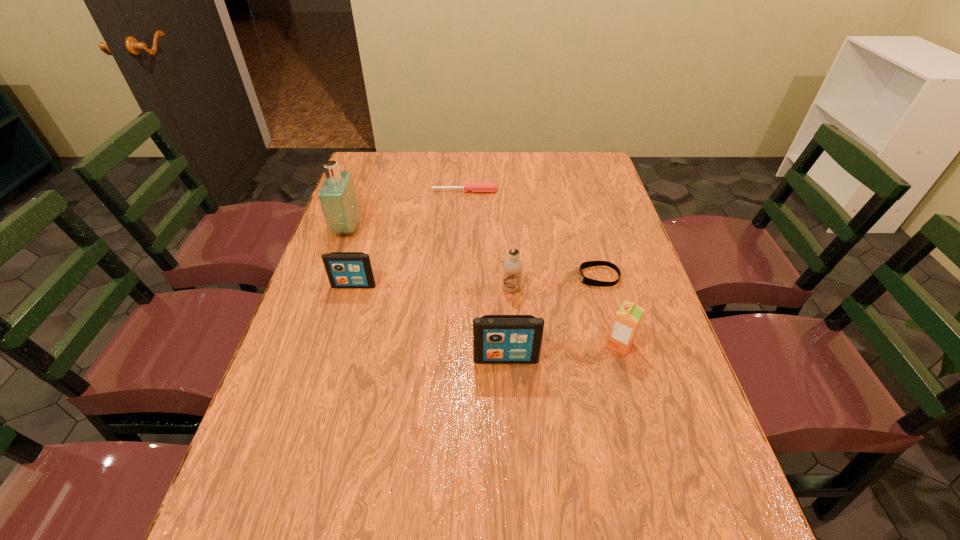
Identify the location of free space between the chocolate milk and the left iPod. The height and width of the screenshot is (540, 960). (433, 287).

This screenshot has width=960, height=540. I want to click on free point between the third shortest object and the chocolate milk, so click(x=433, y=287).

Image resolution: width=960 pixels, height=540 pixels. I want to click on vacant space in between the second shortest object and the tallest object, so click(x=406, y=210).

Where is `empty location between the perfume and the chocolate milk`? empty location between the perfume and the chocolate milk is located at coordinates (429, 259).

I want to click on vacant area that lies between the shortest object and the chocolate milk, so click(555, 282).

Where is `free space between the wristband and the fifth tallest object`? free space between the wristband and the fifth tallest object is located at coordinates (476, 281).

Find the location of `vacant point located between the wristband and the taller iPod`. vacant point located between the wristband and the taller iPod is located at coordinates (552, 318).

Where is `object that ranks as the second closest to the shortest object`? Image resolution: width=960 pixels, height=540 pixels. object that ranks as the second closest to the shortest object is located at coordinates (513, 265).

In order to click on object that ranks as the third closest to the left iPod in this screenshot , I will do `click(513, 265)`.

Identify the location of vacant area that satisfies the following two spatial constraints: 1. on the front screen of the orange juice; 2. on the left side of the left iPod. The image size is (960, 540). (336, 345).